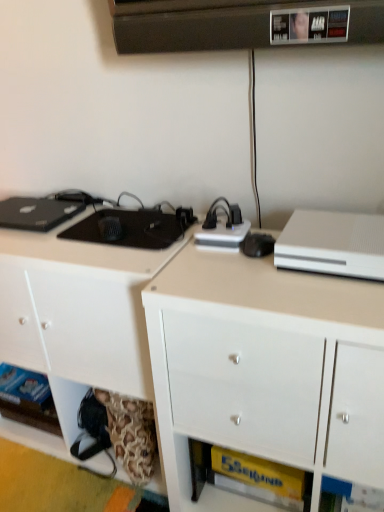
Question: Is white matte cabinet at lower left, the 2th cabinetry positioned from the right, positioned beyond the bounds of white glossy cabinet at center, marked as the first cabinetry in a right-to-left arrangement?

Choices:
 (A) no
 (B) yes

Answer: (B)

Question: Could you tell me if white matte cabinet at lower left, which ranks as the first cabinetry in left-to-right order, is facing white glossy cabinet at center, marked as the first cabinetry in a right-to-left arrangement?

Choices:
 (A) no
 (B) yes

Answer: (A)

Question: Is white matte cabinet at lower left, the 2th cabinetry positioned from the right, behind white glossy cabinet at center, placed as the second cabinetry when sorted from left to right?

Choices:
 (A) yes
 (B) no

Answer: (A)

Question: Considering the relative positions of white matte cabinet at lower left, which ranks as the first cabinetry in left-to-right order, and white glossy cabinet at center, marked as the first cabinetry in a right-to-left arrangement, in the image provided, is white matte cabinet at lower left, which ranks as the first cabinetry in left-to-right order, to the left of white glossy cabinet at center, marked as the first cabinetry in a right-to-left arrangement, from the viewer's perspective?

Choices:
 (A) no
 (B) yes

Answer: (B)

Question: Is white matte cabinet at lower left, which ranks as the first cabinetry in left-to-right order, oriented away from white glossy cabinet at center, placed as the second cabinetry when sorted from left to right?

Choices:
 (A) yes
 (B) no

Answer: (B)

Question: Is white glossy cabinet at center, marked as the first cabinetry in a right-to-left arrangement, inside the boundaries of white matte cabinet at lower left, which ranks as the first cabinetry in left-to-right order, or outside?

Choices:
 (A) inside
 (B) outside

Answer: (B)

Question: Based on their sizes in the image, would you say white glossy cabinet at center, marked as the first cabinetry in a right-to-left arrangement, is bigger or smaller than white matte cabinet at lower left, the 2th cabinetry positioned from the right?

Choices:
 (A) small
 (B) big

Answer: (A)

Question: From the image's perspective, relative to white matte cabinet at lower left, which ranks as the first cabinetry in left-to-right order, is white glossy cabinet at center, placed as the second cabinetry when sorted from left to right, above or below?

Choices:
 (A) below
 (B) above

Answer: (A)

Question: Visually, is white glossy cabinet at center, placed as the second cabinetry when sorted from left to right, positioned to the left or to the right of white matte cabinet at lower left, which ranks as the first cabinetry in left-to-right order?

Choices:
 (A) right
 (B) left

Answer: (A)

Question: Choose the correct answer: Is white matte cabinet at lower left, which ranks as the first cabinetry in left-to-right order, inside white matte desktop computer at upper right or outside it?

Choices:
 (A) outside
 (B) inside

Answer: (A)

Question: Is white matte cabinet at lower left, the 2th cabinetry positioned from the right, taller or shorter than white matte desktop computer at upper right?

Choices:
 (A) short
 (B) tall

Answer: (B)

Question: Would you say white matte cabinet at lower left, the 2th cabinetry positioned from the right, is to the left or to the right of white matte desktop computer at upper right in the picture?

Choices:
 (A) right
 (B) left

Answer: (B)

Question: Is white matte cabinet at lower left, which ranks as the first cabinetry in left-to-right order, bigger or smaller than white matte desktop computer at upper right?

Choices:
 (A) small
 (B) big

Answer: (B)

Question: In terms of height, does white matte desktop computer at upper right look taller or shorter compared to white glossy cabinet at center, marked as the first cabinetry in a right-to-left arrangement?

Choices:
 (A) tall
 (B) short

Answer: (B)

Question: Would you say white matte desktop computer at upper right is inside or outside white glossy cabinet at center, marked as the first cabinetry in a right-to-left arrangement?

Choices:
 (A) outside
 (B) inside

Answer: (A)